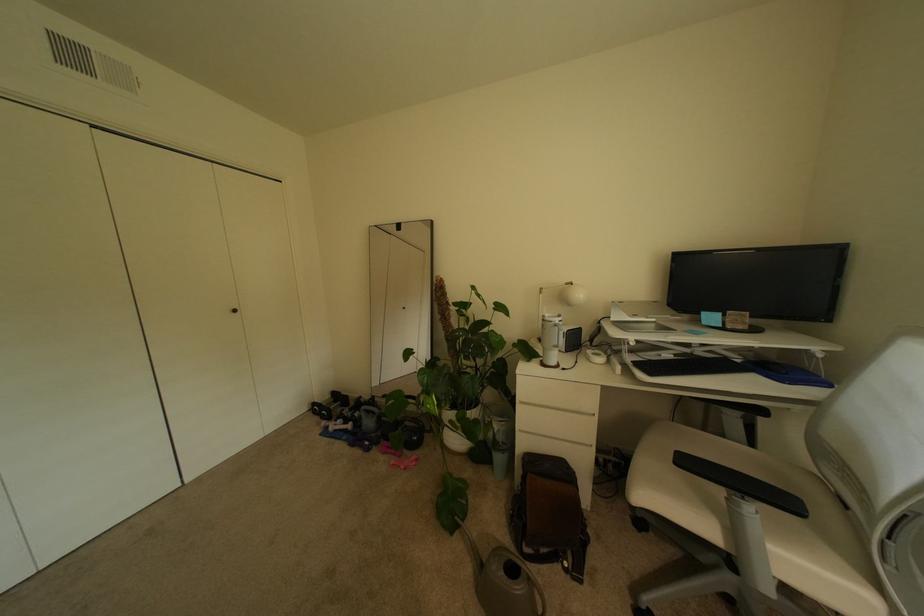
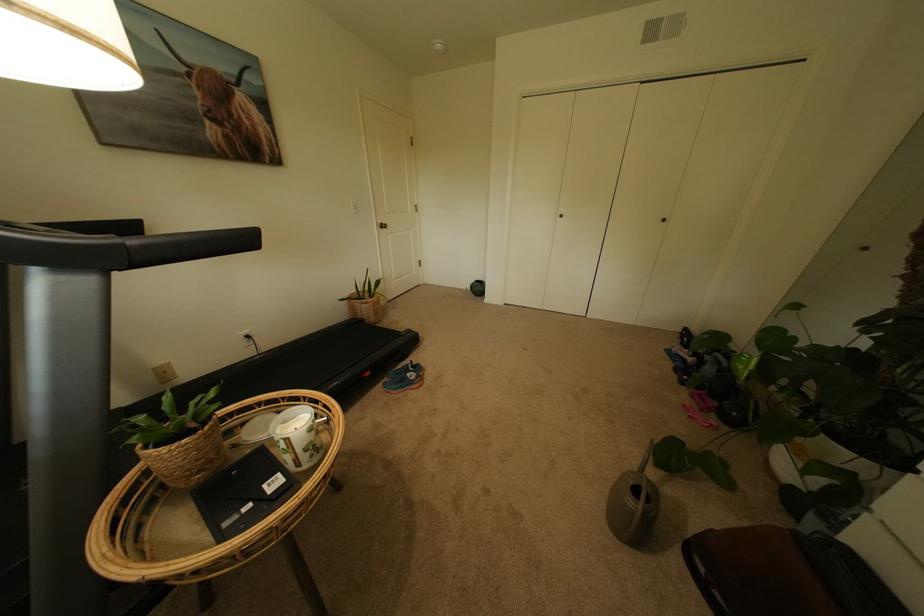
Based on the continuous images, in which direction is the camera rotating?

The rotation direction of the camera is left-down.